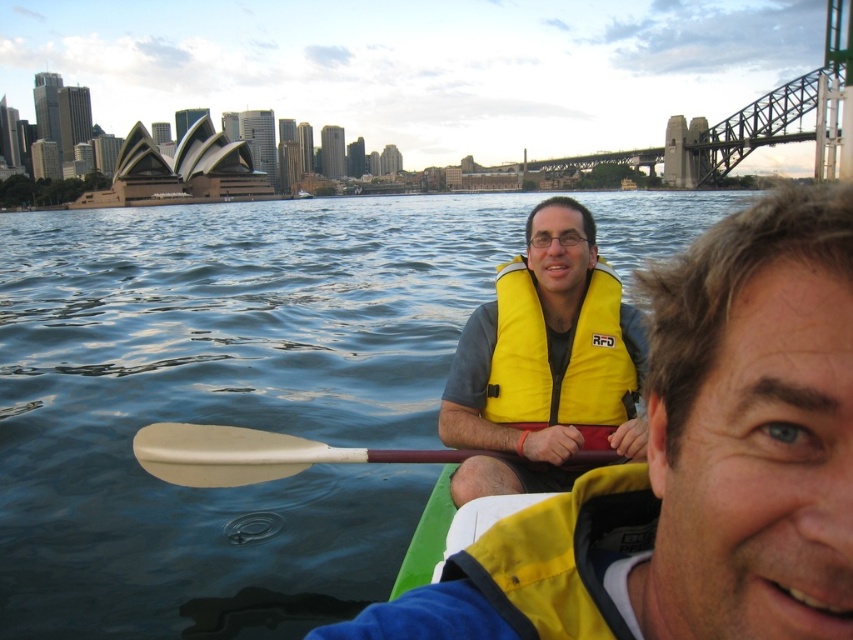
You are a photographer on a boat in Sydney Harbour, near the Sydney Opera House and Bridge. You see a yellow life vest at center and a beige plastic paddle at center. Which object is closer to the right side of your view?

The yellow life vest at center is closer to the right side of the view because it is positioned to the right of the beige plastic paddle at center.